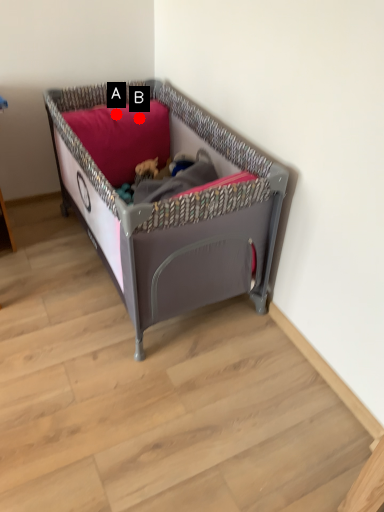
Question: Two points are circled on the image, labeled by A and B beside each circle. Which point is closer to the camera?

Choices:
 (A) A is closer
 (B) B is closer

Answer: (A)